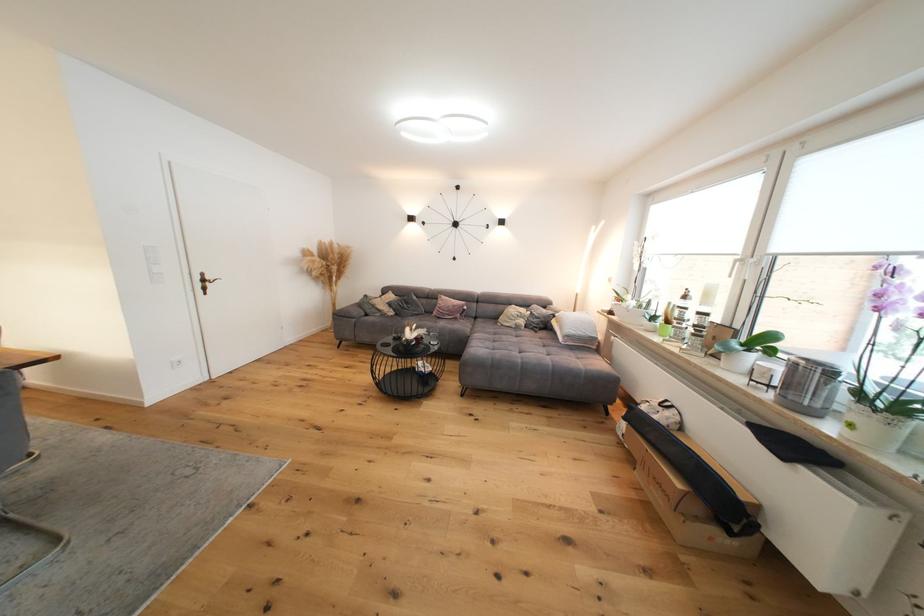
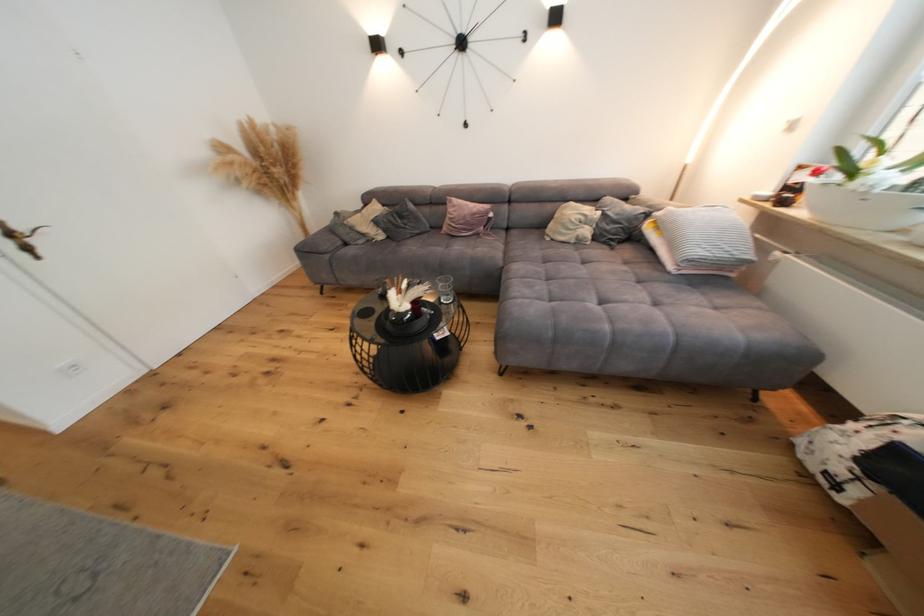
Question: I am providing you with two images of the same scene from different viewpoints. Which of the following objects are not visible in image2?

Choices:
 (A) dark grey pillow
 (B) black decorative vase
 (C) sofa armrest
 (D) none of these

Answer: (D)